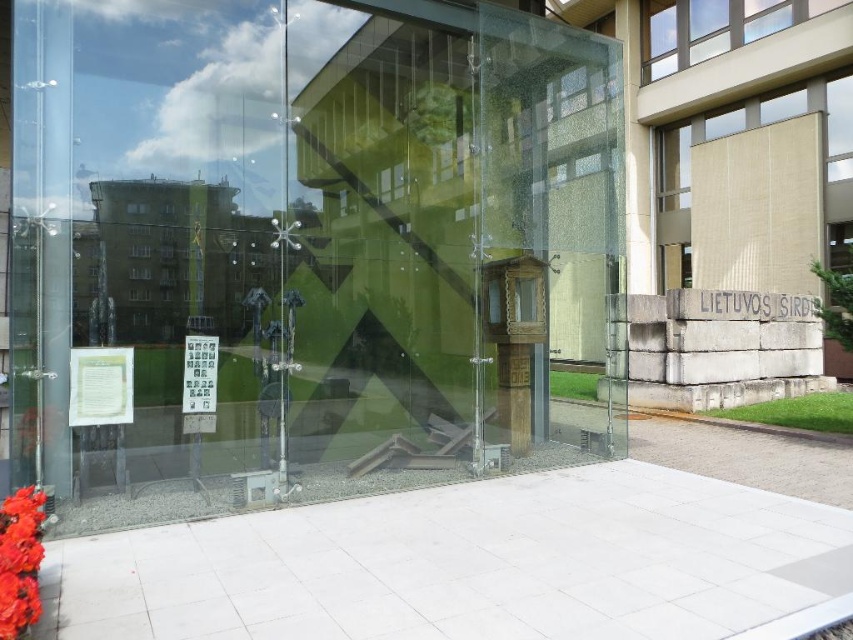
Question: Which point appears closest to the camera in this image?

Choices:
 (A) (328, 90)
 (B) (4, 547)

Answer: (B)

Question: Considering the relative positions of transparent glass box at center and vivid red petals at lower left in the image provided, where is transparent glass box at center located with respect to vivid red petals at lower left?

Choices:
 (A) below
 (B) above

Answer: (B)

Question: Is transparent glass box at center in front of vivid red petals at lower left?

Choices:
 (A) yes
 (B) no

Answer: (B)

Question: Among these points, which one is nearest to the camera?

Choices:
 (A) (45, 250)
 (B) (10, 561)

Answer: (B)

Question: Is transparent glass box at center further to the viewer compared to vivid red petals at lower left?

Choices:
 (A) no
 (B) yes

Answer: (B)